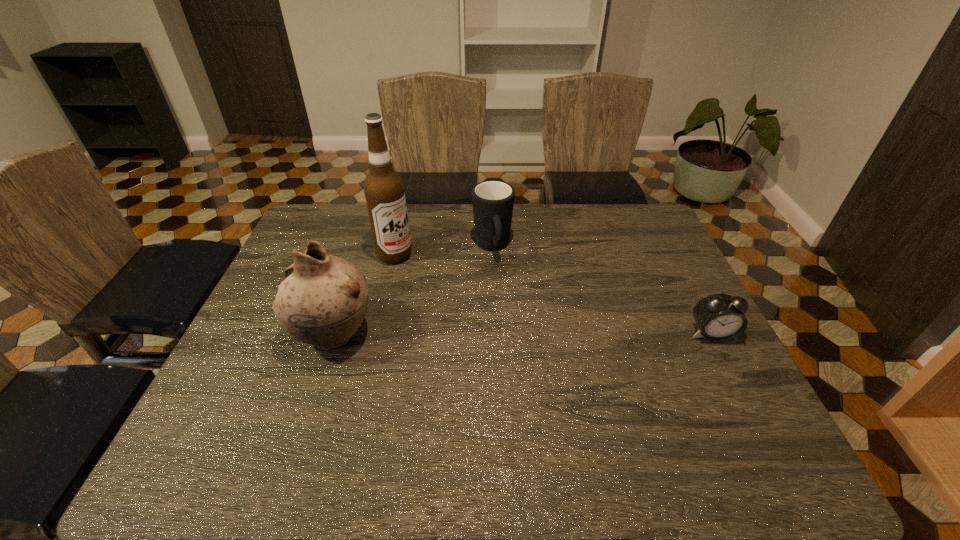
Locate an element on the screen. This screenshot has height=540, width=960. vacant space at the right edge of the desktop is located at coordinates (695, 374).

I want to click on free space at the near left corner, so click(269, 394).

In the image, there is a desktop. Identify the location of free region at the far right corner. The image size is (960, 540). (621, 219).

Locate an element on the screen. empty space between the rightmost object and the mug is located at coordinates (602, 291).

Where is `unoccupied position between the rightmost object and the tallest object`? The height and width of the screenshot is (540, 960). unoccupied position between the rightmost object and the tallest object is located at coordinates (553, 295).

Image resolution: width=960 pixels, height=540 pixels. What are the coordinates of `free spot between the tallest object and the third tallest object` in the screenshot? It's located at (444, 251).

Locate an element on the screen. The height and width of the screenshot is (540, 960). vacant space in between the pottery and the rightmost object is located at coordinates (522, 334).

At what (x,y) coordinates should I click in order to perform the action: click on vacant space that is in between the second object from right to left and the rightmost object. Please return your answer as a coordinate pair (x, y). Looking at the image, I should click on (602, 291).

Find the location of a particular element. The height and width of the screenshot is (540, 960). vacant point located between the second tallest object and the rightmost object is located at coordinates (522, 334).

Image resolution: width=960 pixels, height=540 pixels. In order to click on empty location between the second shortest object and the tallest object in this screenshot , I will do `click(444, 251)`.